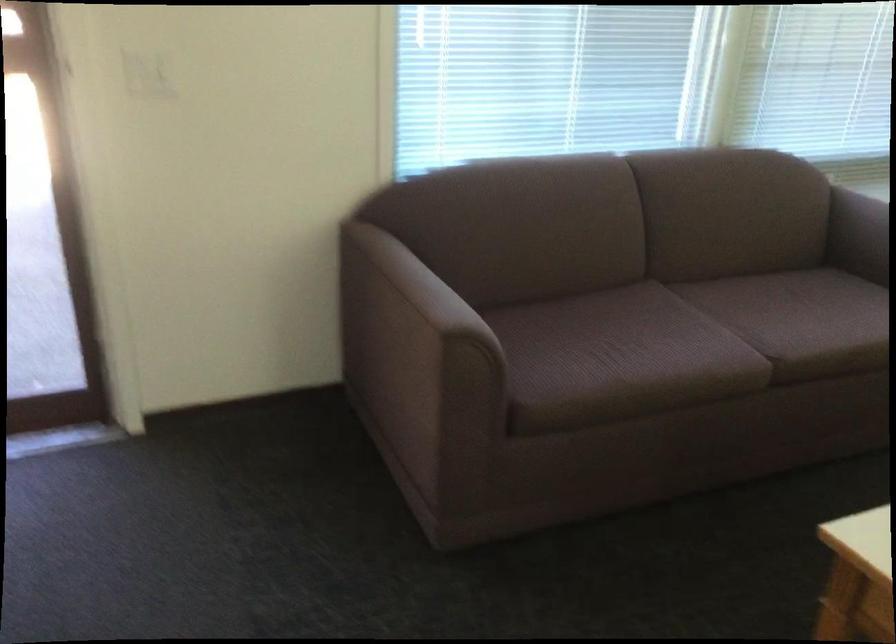
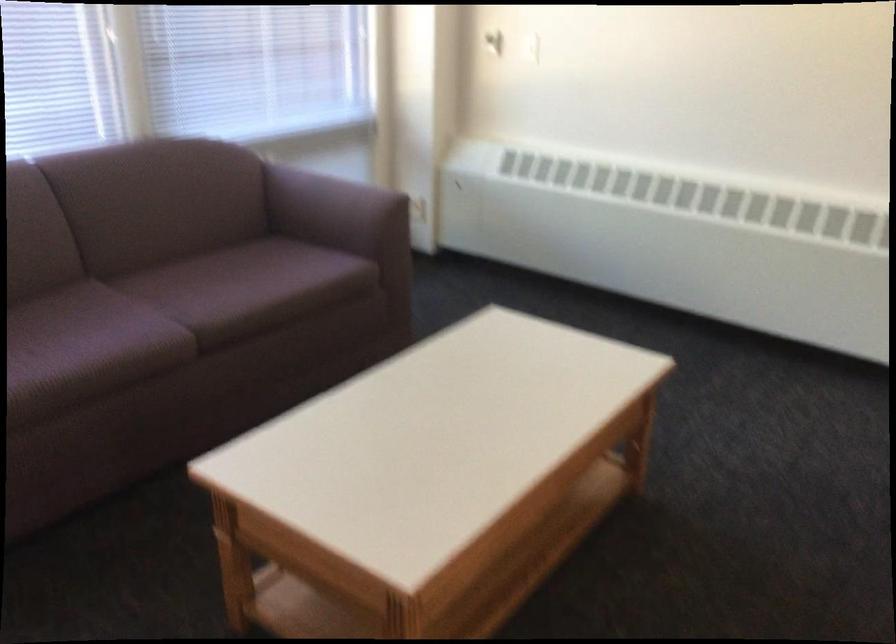
Locate, in the second image, the point that corresponds to the point at 743,337 in the first image.

(168, 316)